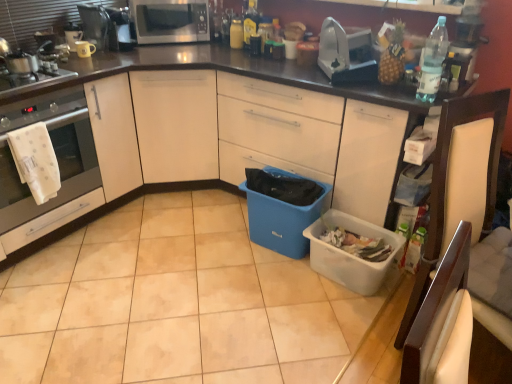
Where is `free space to the left of blue plastic bin at center, the second storage box positioned from the right`? This screenshot has width=512, height=384. free space to the left of blue plastic bin at center, the second storage box positioned from the right is located at coordinates (221, 242).